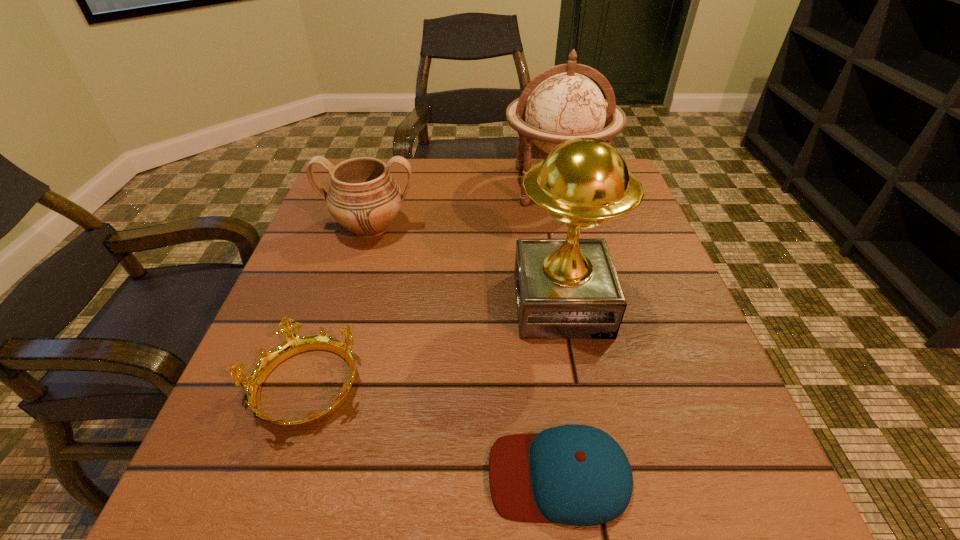
Locate an element on the screen. globe is located at coordinates (565, 105).

Find the location of a particular element. The image size is (960, 540). award is located at coordinates (568, 288).

Find the location of a particular element. The height and width of the screenshot is (540, 960). the third shortest object is located at coordinates (363, 197).

Locate an element on the screen. the fourth tallest object is located at coordinates (294, 344).

The image size is (960, 540). I want to click on the shortest object, so click(x=578, y=475).

Identify the location of free point located 0.050m on the front-facing side of the globe. The width and height of the screenshot is (960, 540). (566, 229).

Where is `vacant space located on the front-facing side of the third nearest object`? Image resolution: width=960 pixels, height=540 pixels. vacant space located on the front-facing side of the third nearest object is located at coordinates (313, 304).

Identify the location of vacant area situated on the front-facing side of the third nearest object. (307, 304).

At what (x,y) coordinates should I click in order to perform the action: click on free spot located on the front-facing side of the third nearest object. Please return your answer as a coordinate pair (x, y). The image size is (960, 540). Looking at the image, I should click on (470, 304).

Find the location of a particular element. This screenshot has height=540, width=960. free location located 0.170m on the front-facing side of the third tallest object is located at coordinates (347, 309).